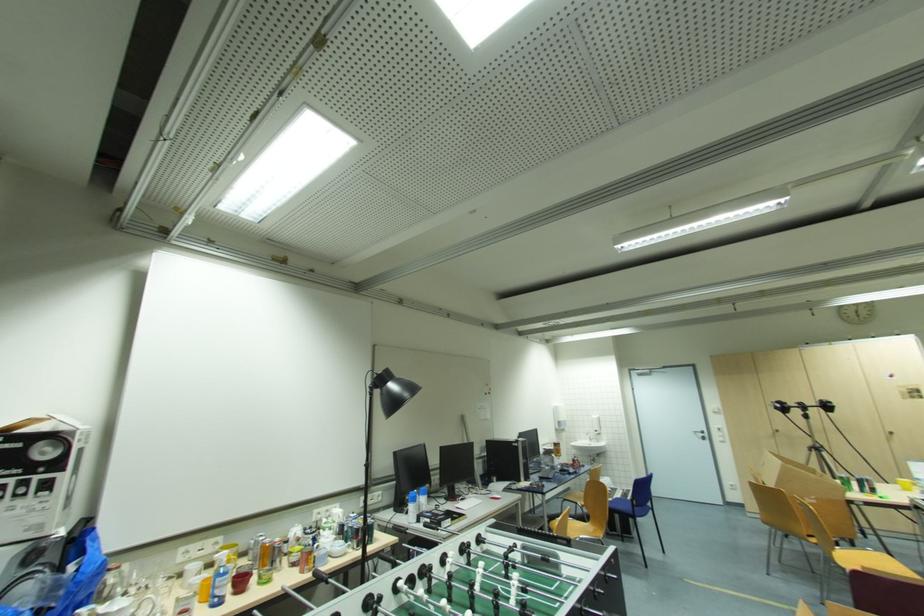
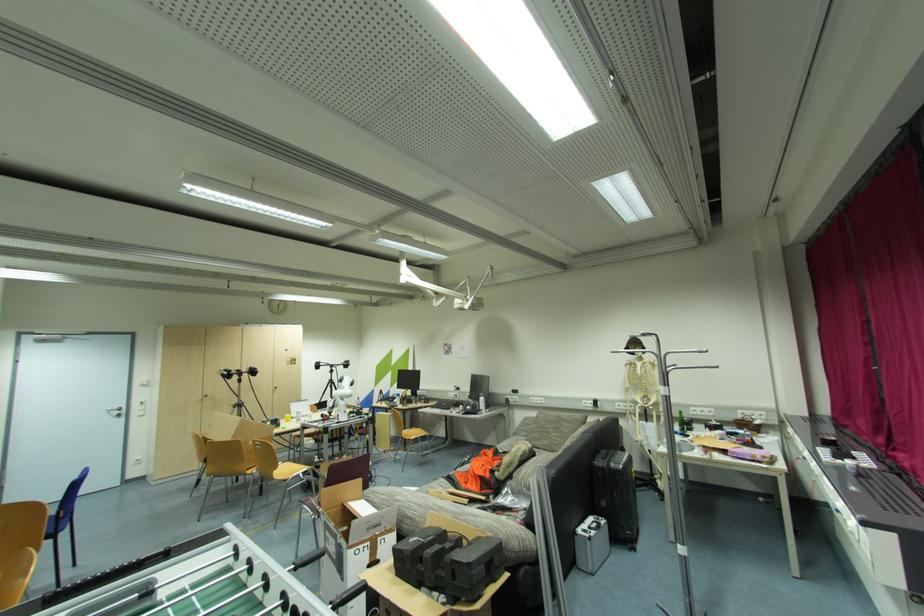
Find the pixel in the second image that matches pixel 835 548 in the first image.

(280, 469)